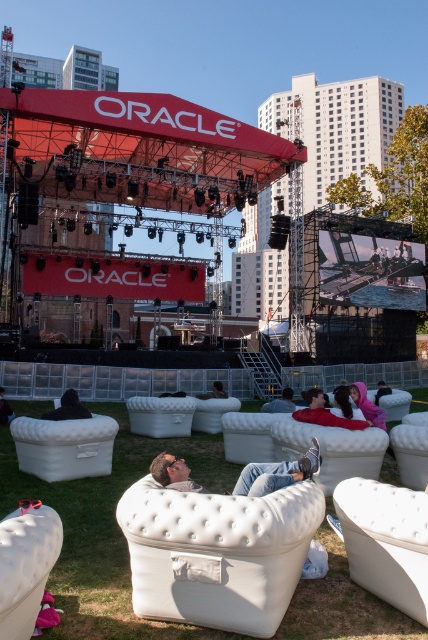
Question: Can you confirm if light brown leather couch at center is positioned to the left of dark hair person at lower left?

Choices:
 (A) yes
 (B) no

Answer: (B)

Question: Estimate the real-world distances between objects in this image. Which object is closer to the light brown leather couch at center?

Choices:
 (A) dark blue fabric jacket at lower center
 (B) white fabric couch at center

Answer: (B)

Question: From the image, what is the correct spatial relationship of red matte oracle canopy at upper center in relation to dark gray fabric couch at center?

Choices:
 (A) left
 (B) right

Answer: (A)

Question: Which object is closer to the camera taking this photo?

Choices:
 (A) red matte oracle canopy at upper center
 (B) white fabric couch at center
 (C) dark gray fabric couch at center

Answer: (B)

Question: Which object appears farthest from the camera in this image?

Choices:
 (A) dark blue fabric jacket at lower center
 (B) dark gray fabric couch at center

Answer: (B)

Question: Does green soft grass at lower center appear on the right side of dark blue fabric jacket at lower center?

Choices:
 (A) no
 (B) yes

Answer: (B)